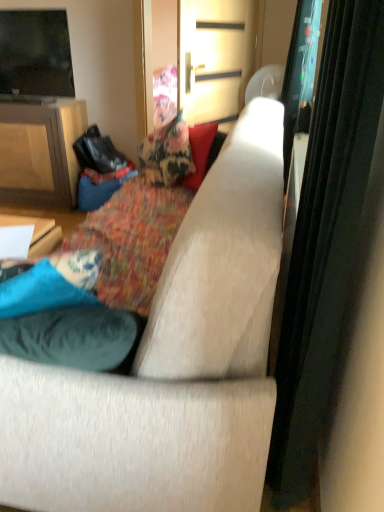
Question: Would you say matte wood cabinet at left contains suede-like beige couch at center?

Choices:
 (A) no
 (B) yes

Answer: (A)

Question: Is matte wood cabinet at left not inside suede-like beige couch at center?

Choices:
 (A) yes
 (B) no

Answer: (A)

Question: Is matte wood cabinet at left not close to suede-like beige couch at center?

Choices:
 (A) yes
 (B) no

Answer: (A)

Question: Considering the relative sizes of matte wood cabinet at left and suede-like beige couch at center in the image provided, is matte wood cabinet at left wider than suede-like beige couch at center?

Choices:
 (A) no
 (B) yes

Answer: (A)

Question: Does matte wood cabinet at left have a greater height compared to suede-like beige couch at center?

Choices:
 (A) yes
 (B) no

Answer: (B)

Question: Considering their positions, is metallic gold door at upper center, arranged as the second screen door when viewed from the right, located in front of or behind floral fabric cushion at center?

Choices:
 (A) front
 (B) behind

Answer: (B)

Question: From a real-world perspective, is metallic gold door at upper center, arranged as the second screen door when viewed from the right, above or below floral fabric cushion at center?

Choices:
 (A) below
 (B) above

Answer: (B)

Question: Is point (220, 70) closer or farther from the camera than point (69, 245)?

Choices:
 (A) farther
 (B) closer

Answer: (A)

Question: Which is correct: metallic gold door at upper center, the first screen door when ordered from left to right, is inside floral fabric cushion at center, or outside of it?

Choices:
 (A) outside
 (B) inside

Answer: (A)

Question: Do you think transparent glass screen door at upper right, acting as the 1th screen door starting from the right, is within suede-like beige couch at center, or outside of it?

Choices:
 (A) outside
 (B) inside

Answer: (A)

Question: Considering the relative positions of transparent glass screen door at upper right, the second screen door viewed from the left, and suede-like beige couch at center in the image provided, is transparent glass screen door at upper right, the second screen door viewed from the left, to the left or to the right of suede-like beige couch at center?

Choices:
 (A) right
 (B) left

Answer: (A)

Question: From the image's perspective, relative to suede-like beige couch at center, is transparent glass screen door at upper right, the second screen door viewed from the left, above or below?

Choices:
 (A) below
 (B) above

Answer: (B)

Question: Looking at the image, does transparent glass screen door at upper right, acting as the 1th screen door starting from the right, seem bigger or smaller compared to suede-like beige couch at center?

Choices:
 (A) small
 (B) big

Answer: (A)

Question: Based on their sizes in the image, would you say matte wood cabinet at left is bigger or smaller than flat screen tv at upper left?

Choices:
 (A) small
 (B) big

Answer: (B)

Question: Is point (3, 98) positioned closer to the camera than point (56, 95)?

Choices:
 (A) closer
 (B) farther

Answer: (A)